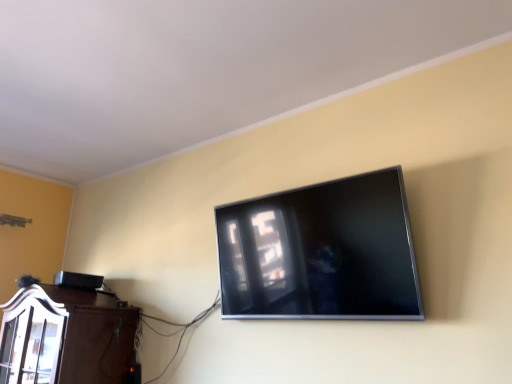
Question: From a real-world perspective, relative to satin black tv at upper center, is brown wood cabinet at lower left vertically above or below?

Choices:
 (A) above
 (B) below

Answer: (B)

Question: Is point (124, 332) closer or farther from the camera than point (333, 236)?

Choices:
 (A) closer
 (B) farther

Answer: (B)

Question: Looking at the image, does brown wood cabinet at lower left seem bigger or smaller compared to satin black tv at upper center?

Choices:
 (A) big
 (B) small

Answer: (A)

Question: Considering the positions of point click(x=339, y=306) and point click(x=49, y=382), is point click(x=339, y=306) closer or farther from the camera than point click(x=49, y=382)?

Choices:
 (A) closer
 (B) farther

Answer: (A)

Question: In terms of height, does satin black tv at upper center look taller or shorter compared to brown wood cabinet at lower left?

Choices:
 (A) tall
 (B) short

Answer: (A)

Question: Considering the positions of satin black tv at upper center and brown wood cabinet at lower left in the image, is satin black tv at upper center bigger or smaller than brown wood cabinet at lower left?

Choices:
 (A) big
 (B) small

Answer: (B)

Question: Looking at their shapes, would you say satin black tv at upper center is wider or thinner than brown wood cabinet at lower left?

Choices:
 (A) wide
 (B) thin

Answer: (B)